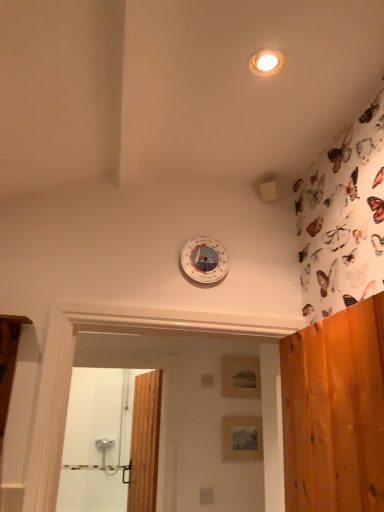
Question: From a real-world perspective, is matte wooden panel at center, the first panel when ordered from bottom to top, above or below wooden door at center?

Choices:
 (A) below
 (B) above

Answer: (B)

Question: Is matte wooden panel at center, placed as the first panel when sorted from front to back, inside or outside of wooden door at center?

Choices:
 (A) outside
 (B) inside

Answer: (A)

Question: Which object is positioned farthest from the white plastic clock at upper center?

Choices:
 (A) matte wooden panel at center, which is the second panel from front to back
 (B) matte white light fixture at upper center
 (C) matte wooden panel at center, the first panel when ordered from bottom to top
 (D) wooden door at center
 (E) wooden screen door at lower left

Answer: (E)

Question: Which object is positioned farthest from the wooden door at center?

Choices:
 (A) matte wooden panel at center, which is the 2th panel from bottom to top
 (B) white plastic clock at upper center
 (C) matte wooden panel at center, the second panel from the back
 (D) matte white light fixture at upper center
 (E) wooden screen door at lower left

Answer: (D)